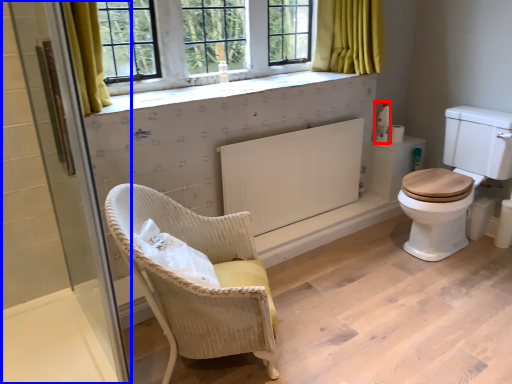
Question: Which of the following is the farthest to the observer, toiletries (highlighted by a red box) or screen door (highlighted by a blue box)?

Choices:
 (A) toiletries
 (B) screen door

Answer: (A)